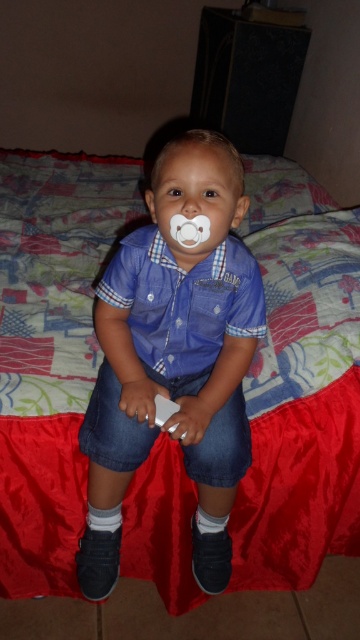
Question: Which of these objects is positioned farthest from the blue denim shorts at center?

Choices:
 (A) white plastic wii controller at center
 (B) blue plaid shirt at center

Answer: (A)

Question: Which point is farther to the camera?

Choices:
 (A) (223, 220)
 (B) (169, 416)

Answer: (B)

Question: Does blue denim shorts at center have a greater width compared to white plastic wii controller at center?

Choices:
 (A) yes
 (B) no

Answer: (A)

Question: Does blue denim shorts at center appear on the right side of white plastic wii controller at center?

Choices:
 (A) yes
 (B) no

Answer: (A)

Question: Which point appears farthest from the camera in this image?

Choices:
 (A) pos(127,458)
 (B) pos(212,317)

Answer: (B)

Question: Does blue denim shorts at center appear over white plastic wii controller at center?

Choices:
 (A) yes
 (B) no

Answer: (A)